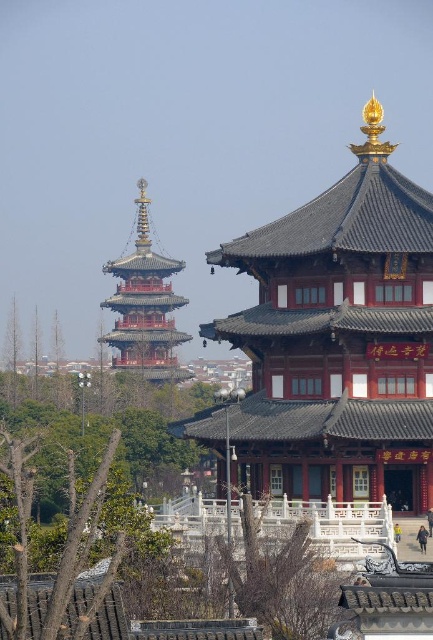
Question: Does shiny gold pagoda at upper left have a smaller size compared to reddish-brown wooden pagoda at upper left?

Choices:
 (A) no
 (B) yes

Answer: (B)

Question: Which of the following is the closest to the observer?

Choices:
 (A) (326, 282)
 (B) (109, 336)

Answer: (A)

Question: Which point appears farthest from the camera in this image?

Choices:
 (A) (148, 349)
 (B) (370, 374)

Answer: (A)

Question: Can you confirm if shiny gold pagoda at upper left is positioned above reddish-brown wooden pagoda at upper left?

Choices:
 (A) yes
 (B) no

Answer: (B)

Question: Does shiny gold pagoda at upper left come behind reddish-brown wooden pagoda at upper left?

Choices:
 (A) no
 (B) yes

Answer: (A)

Question: Which point is farther to the camera?

Choices:
 (A) shiny gold pagoda at upper left
 (B) reddish-brown wooden pagoda at upper left

Answer: (B)